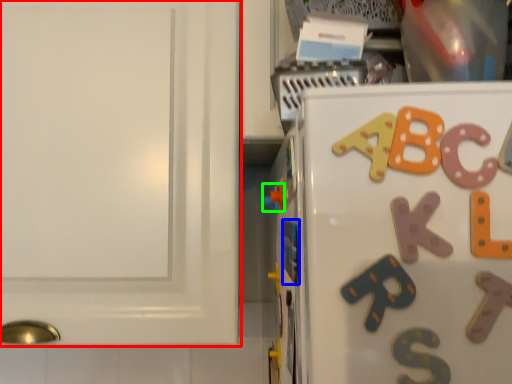
Question: Which object is positioned closest to cabinetry (highlighted by a red box)? Select from magnet (highlighted by a blue box) and toy (highlighted by a green box).

Choices:
 (A) magnet
 (B) toy

Answer: (B)